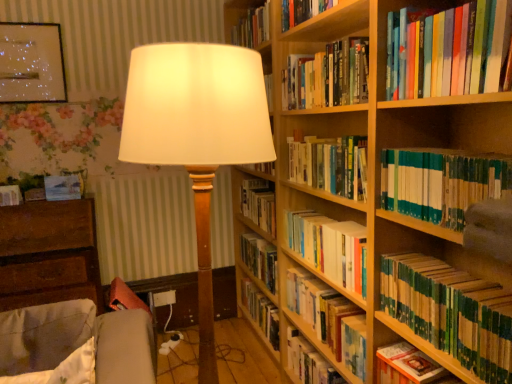
Question: Should I look upward or downward to see brown wooden chest of drawers at lower left?

Choices:
 (A) up
 (B) down

Answer: (B)

Question: Considering the relative sizes of matte white lampshade at center and green matte book at lower right, which appears as the 5th book when viewed from the top, in the image provided, is matte white lampshade at center bigger than green matte book at lower right, which appears as the 5th book when viewed from the top,?

Choices:
 (A) no
 (B) yes

Answer: (B)

Question: Is matte white lampshade at center facing towards green matte book at lower right, which appears as the 5th book when viewed from the top?

Choices:
 (A) yes
 (B) no

Answer: (B)

Question: From a real-world perspective, does matte white lampshade at center sit lower than green matte book at lower right, which appears as the 5th book when viewed from the top?

Choices:
 (A) yes
 (B) no

Answer: (B)

Question: Does matte white lampshade at center have a smaller size compared to green matte book at lower right, which appears as the 5th book when viewed from the top?

Choices:
 (A) no
 (B) yes

Answer: (A)

Question: From the image's perspective, is matte white lampshade at center beneath green matte book at lower right, the fourth book from the bottom?

Choices:
 (A) no
 (B) yes

Answer: (A)

Question: Is matte white lampshade at center not near green matte book at lower right, which appears as the 5th book when viewed from the top?

Choices:
 (A) no
 (B) yes

Answer: (A)

Question: Can you see hardcover books at center, which is the fourth book in top-to-bottom order, touching matte white lampshade at center?

Choices:
 (A) yes
 (B) no

Answer: (B)

Question: Is hardcover books at center, which is the fourth book in top-to-bottom order, oriented away from matte white lampshade at center?

Choices:
 (A) yes
 (B) no

Answer: (B)

Question: Does hardcover books at center, which is the fourth book in top-to-bottom order, have a lesser width compared to matte white lampshade at center?

Choices:
 (A) yes
 (B) no

Answer: (A)

Question: Is hardcover books at center, which appears as the fifth book when ordered from the bottom, far from matte white lampshade at center?

Choices:
 (A) yes
 (B) no

Answer: (B)

Question: Is hardcover books at center, which is the fourth book in top-to-bottom order, positioned in front of matte white lampshade at center?

Choices:
 (A) no
 (B) yes

Answer: (A)

Question: Is hardcover books at center, which is the fourth book in top-to-bottom order, to the right of matte white lampshade at center from the viewer's perspective?

Choices:
 (A) yes
 (B) no

Answer: (A)

Question: Can you confirm if hardcover book at upper right, the 1th book from the top, is wider than hardcover book at lower right, the 2th book in the bottom-to-top sequence?

Choices:
 (A) no
 (B) yes

Answer: (A)